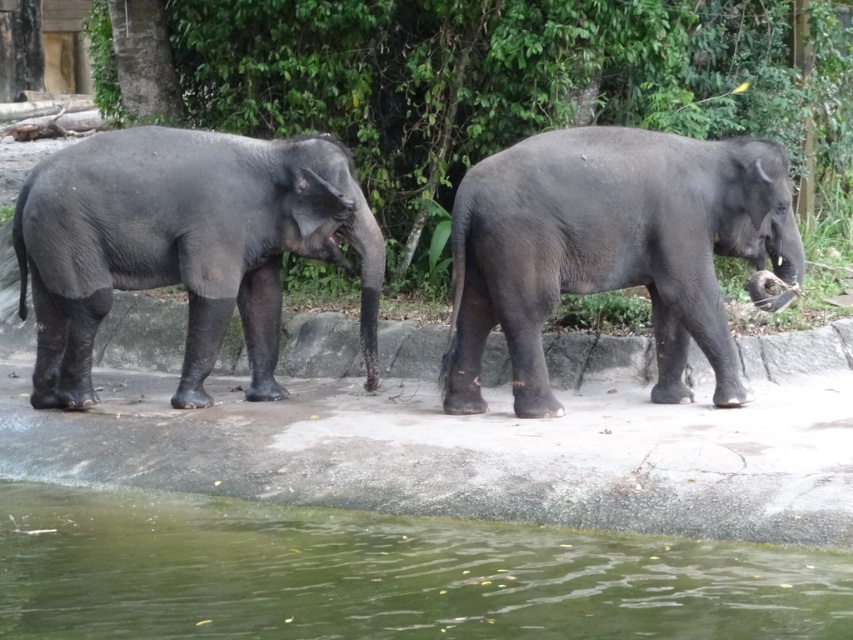
You are a wildlife photographer standing at the camera position. You want to take a closeup photo of the gray matte elephant at right. Considering the distance, is it possible to capture the entire elephant in a single frame without moving the camera?

The gray matte elephant at right is 6.09 meters away from camera. Since the distance is relatively far, it might be challenging to capture the entire elephant in a single frame without moving the camera, unless using a wide angle lens.

You are a zookeeper observing the two gray matte elephants. You notice that the gray matte elephant at right is blocking your view of the gray matte elephant at left. Which elephant is closer to you?

The gray matte elephant at right is closer to you because it is in front of the gray matte elephant at left, blocking your view.

You are a zookeeper trying to locate two specific points in the image of the elephants. The first point is at coordinate point [109,582] and the second is at point [769,148]. Which point is closer to the observer?

Point [109,582] is in front of point [769,148], so the first point is closer to the observer.